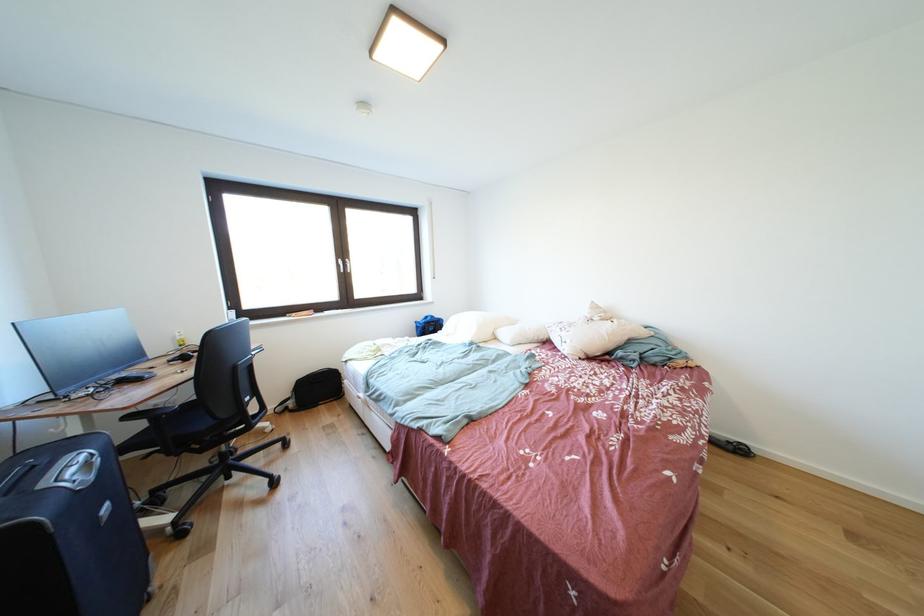
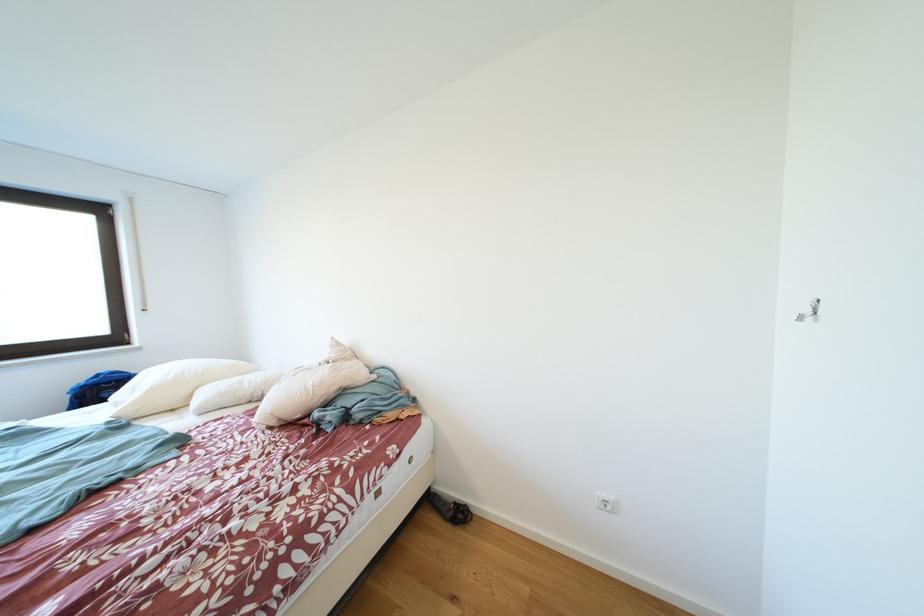
Question: Which direction would the cameraman need to move to produce the second image? Reply with the corresponding letter.

Choices:
 (A) Left
 (B) Right
 (C) Forward
 (D) Backward

Answer: (B)